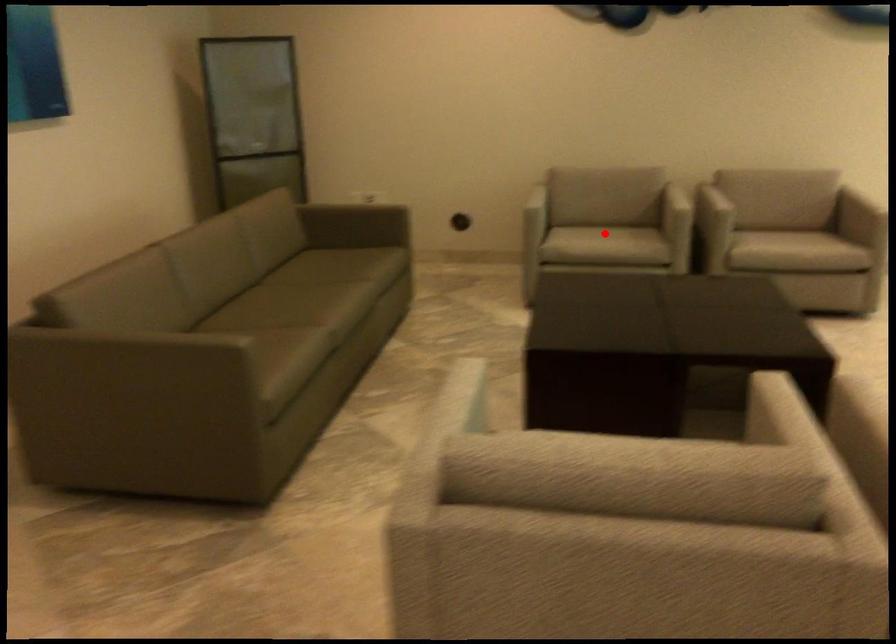
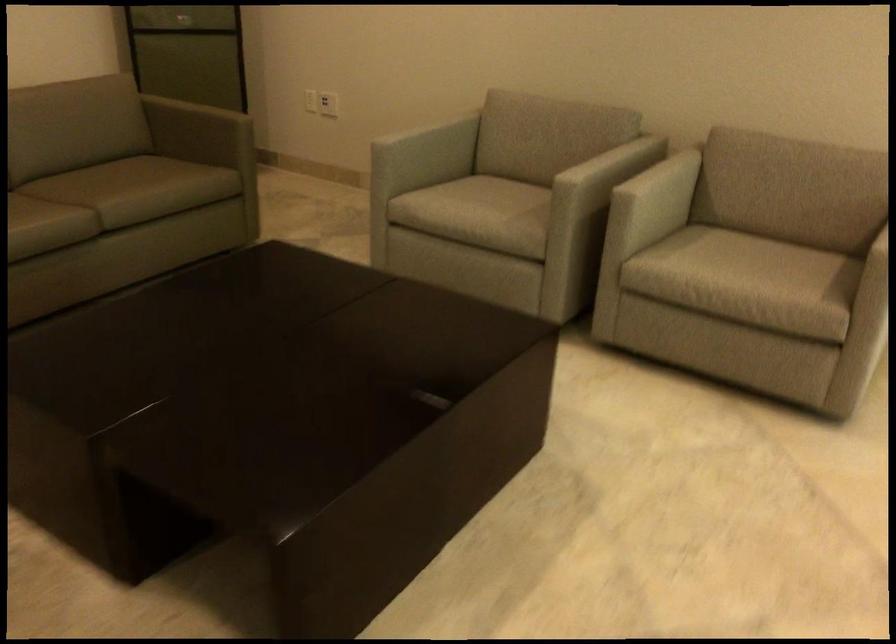
Question: I am providing you with two images of the same scene from different viewpoints. Given a red point in image1, look at the same physical point in image2. Is it:

Choices:
 (A) Closer to the viewpoint
 (B) Farther from the viewpoint

Answer: (A)